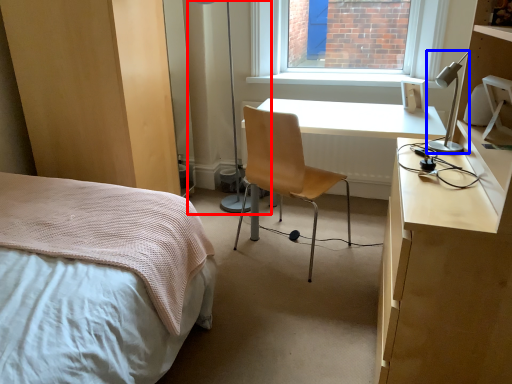
Question: Which object appears farthest to the camera in this image, table lamp (highlighted by a red box) or lamp (highlighted by a blue box)?

Choices:
 (A) table lamp
 (B) lamp

Answer: (A)